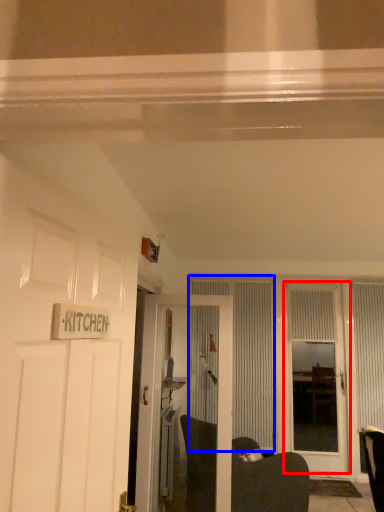
Question: Which object appears closest to the camera in this image, door (highlighted by a red box) or curtain (highlighted by a blue box)?

Choices:
 (A) door
 (B) curtain

Answer: (A)